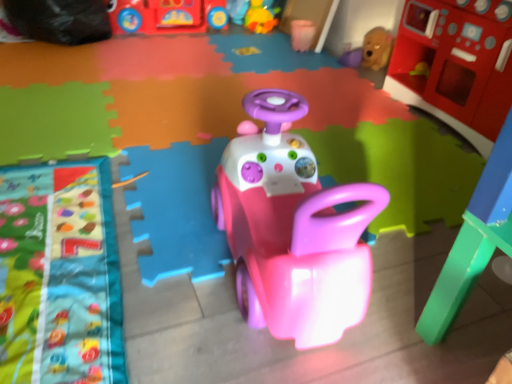
Identify the location of vacant space in front of pink plastic cup at upper center, which ranks as the 3th toy in right-to-left order. (308, 57).